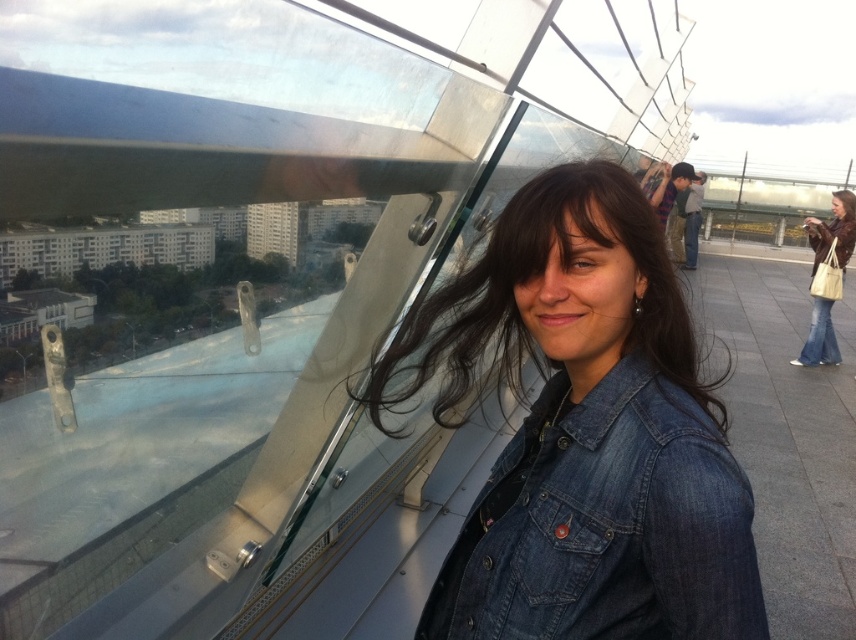
You are a photographer trying to capture both the denim jacket at center and the matte brown leather jacket at lower right in a single shot. Given their spatial relationship, which jacket will appear smaller in the photo?

The denim jacket at center will appear smaller in the photo because it occupies less space than the matte brown leather jacket at lower right.